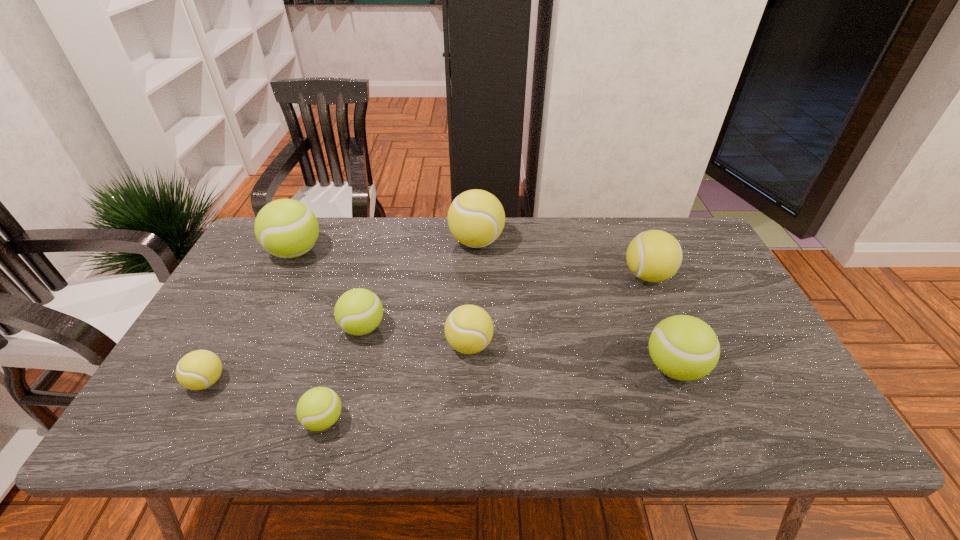
Where is `the farthest yellow tennis ball`? This screenshot has height=540, width=960. the farthest yellow tennis ball is located at coordinates (476, 218).

The image size is (960, 540). Find the location of `the biggest green tennis ball`. the biggest green tennis ball is located at coordinates (286, 228).

Identify the location of the farthest green tennis ball. This screenshot has height=540, width=960. (286, 228).

This screenshot has height=540, width=960. Identify the location of the third smallest yellow tennis ball. (654, 255).

Identify the location of the rightmost yellow tennis ball. (654, 255).

Locate an element on the screen. The image size is (960, 540). the rightmost green tennis ball is located at coordinates (683, 347).

This screenshot has width=960, height=540. In order to click on the second smallest yellow tennis ball in this screenshot , I will do `click(469, 329)`.

Locate an element on the screen. the third biggest green tennis ball is located at coordinates (359, 311).

At what (x,y) coordinates should I click in order to perform the action: click on the leftmost yellow tennis ball. Please return your answer as a coordinate pair (x, y). The width and height of the screenshot is (960, 540). Looking at the image, I should click on (197, 370).

Where is `the nearest yellow tennis ball`? This screenshot has width=960, height=540. the nearest yellow tennis ball is located at coordinates (197, 370).